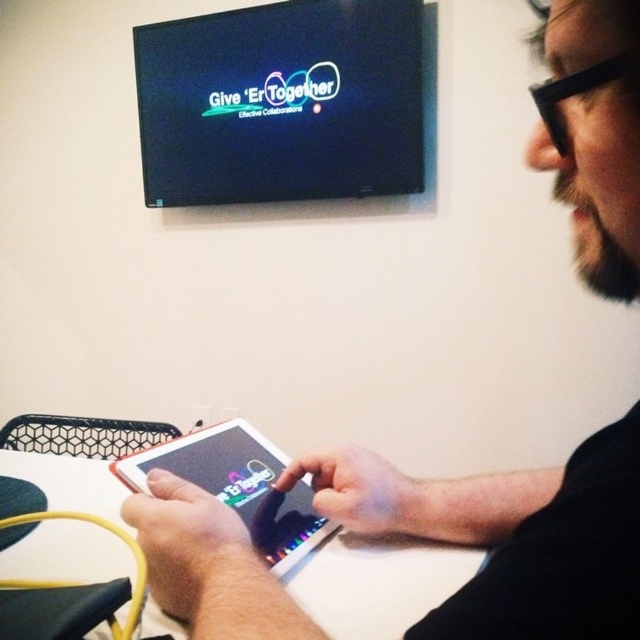
Question: Which point is closer to the camera?

Choices:
 (A) (19, 556)
 (B) (310, 518)

Answer: (B)

Question: Is white glossy table at center to the right of matte black tablet at center from the viewer's perspective?

Choices:
 (A) yes
 (B) no

Answer: (B)

Question: Can you confirm if white glossy table at center is bigger than matte black tablet at center?

Choices:
 (A) no
 (B) yes

Answer: (B)

Question: Observing the image, what is the correct spatial positioning of white glossy table at center in reference to matte black tablet at center?

Choices:
 (A) below
 (B) above

Answer: (A)